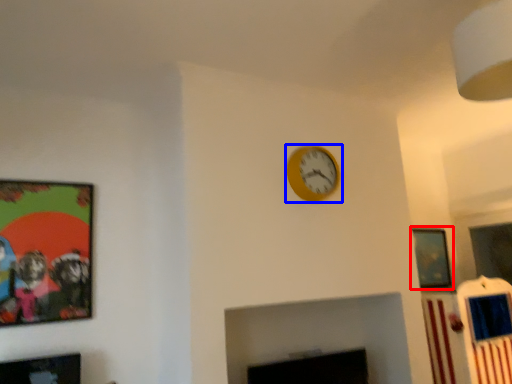
Question: Which object is closer to the camera taking this photo, picture frame (highlighted by a red box) or wall clock (highlighted by a blue box)?

Choices:
 (A) picture frame
 (B) wall clock

Answer: (B)